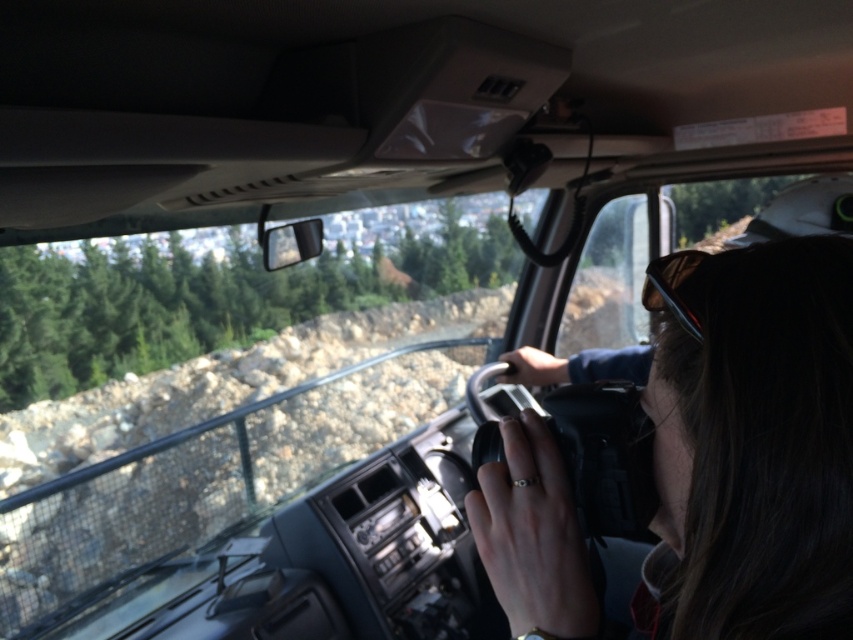
Who is positioned more to the left, matte black camera at center or sunglasses at center?

From the viewer's perspective, sunglasses at center appears more on the left side.

In the scene shown: Between matte black camera at center and sunglasses at center, which one is positioned higher?

sunglasses at center is higher up.

Between point (689, 385) and point (666, 264), which one is positioned in front?

Positioned in front is point (689, 385).

Identify the location of matte black camera at center. The width and height of the screenshot is (853, 640). (758, 444).